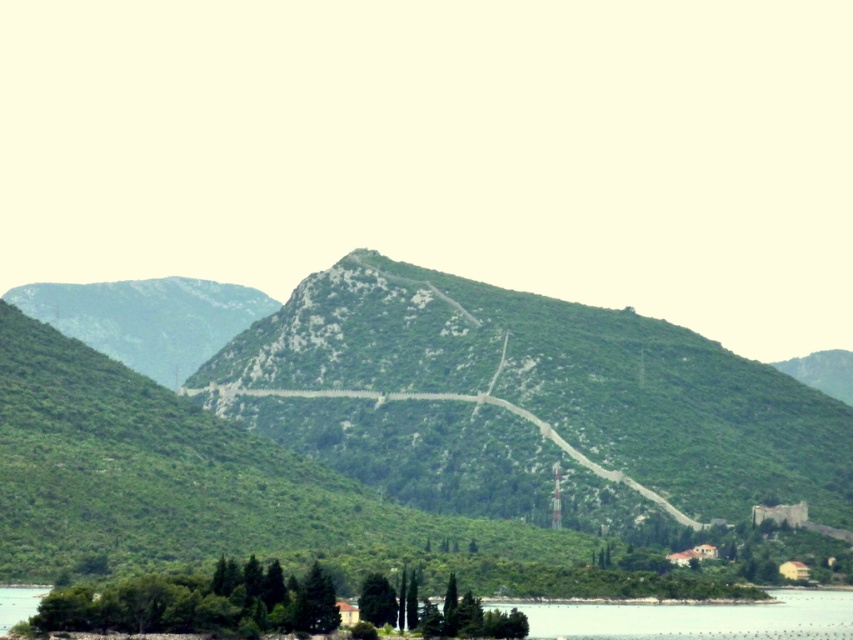
You are an explorer trying to navigate through the mountainous landscape. You see the green textured hill at center and the green stone path at center. Which one would you choose to traverse if you want to take the wider route?

The green textured hill at center has a larger size compared to the green stone path at center, so you should choose the green textured hill at center for a wider route.

From the picture: You are a hiker planning to walk from the green stone path at center to the green textured hill at center. Based on the distance between them, can you estimate how long it would take you to reach the hill if you walk at a steady pace of 3 meters per minute?

The green textured hill at center and green stone path at center are 22.28 meters apart. At a pace of 3 meters per minute, it would take approximately 7.43 minutes to reach the hill. Since you can round to the nearest whole number, it would take about 7 minutes.

You are standing at the base of the mountain and see the green textured hill at center and the green stone path at center. Which one is positioned to the right side from your perspective?

The green textured hill at center is positioned to the right of the green stone path at center, so the green textured hill at center is on the right side.